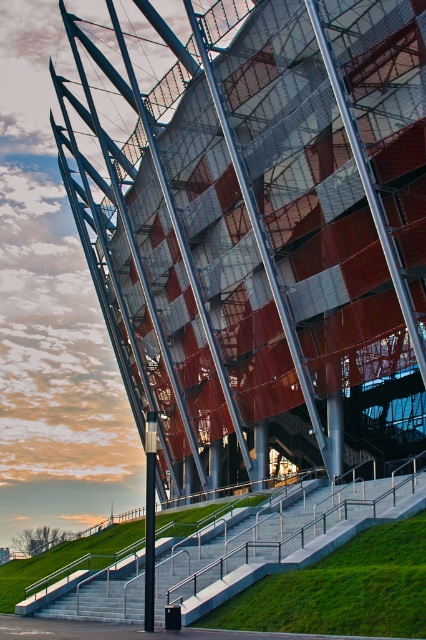
You are an architect reviewing the blueprint of the stadium. You notice two points marked on the design at coordinates point (391, 65) and point (368, 486). Which point is closer to the camera in the blueprint?

Point (368, 486) is closer to the camera than point (391, 65) because the description states that point (391, 65) is further away.

You are standing in front of the modern stadium or sports arena depicted in the image. There is a point marked at coordinates point (256,227). What does this point indicate?

The point (256,227) marks the metallic red and gray stadium at center.

You are standing at the base of the concrete stairs at lower left and want to reach the entrance of the metallic red and gray stadium at center. Which direction should you head towards?

You should head to the right because the metallic red and gray stadium at center is located to the left of the concrete stairs at lower left, so moving right from the stairs will lead you towards the stadium.